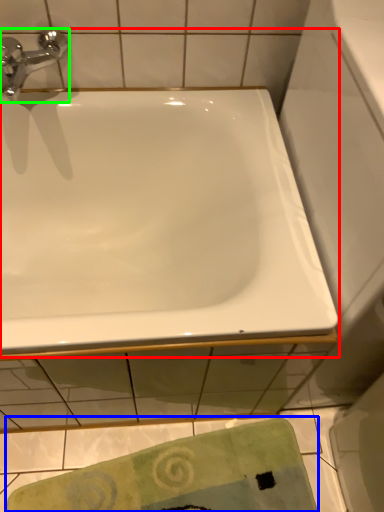
Question: Which is nearer to the bathtub (highlighted by a red box)? beach towel (highlighted by a blue box) or tap (highlighted by a green box).

Choices:
 (A) beach towel
 (B) tap

Answer: (B)